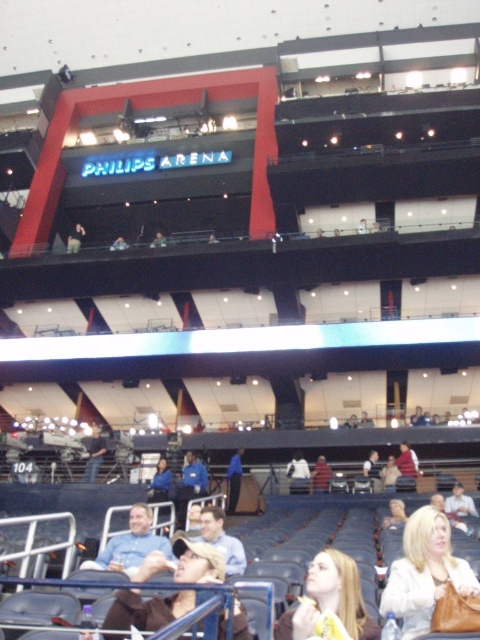
Question: Can you confirm if white leather jacket at lower right is smaller than blonde hair at center?

Choices:
 (A) yes
 (B) no

Answer: (B)

Question: Is white leather jacket at lower right further to the viewer compared to blonde hair at center?

Choices:
 (A) no
 (B) yes

Answer: (B)

Question: Which object is the farthest from the blonde hair at center?

Choices:
 (A) white leather jacket at lower right
 (B) light brown leather jacket at lower center

Answer: (B)

Question: Which of the following is the farthest from the observer?

Choices:
 (A) (444, 531)
 (B) (322, 593)

Answer: (A)

Question: Which of the following is the farthest from the observer?

Choices:
 (A) (416, 612)
 (B) (224, 620)

Answer: (A)

Question: Is light brown leather jacket at lower center smaller than blonde hair at center?

Choices:
 (A) yes
 (B) no

Answer: (B)